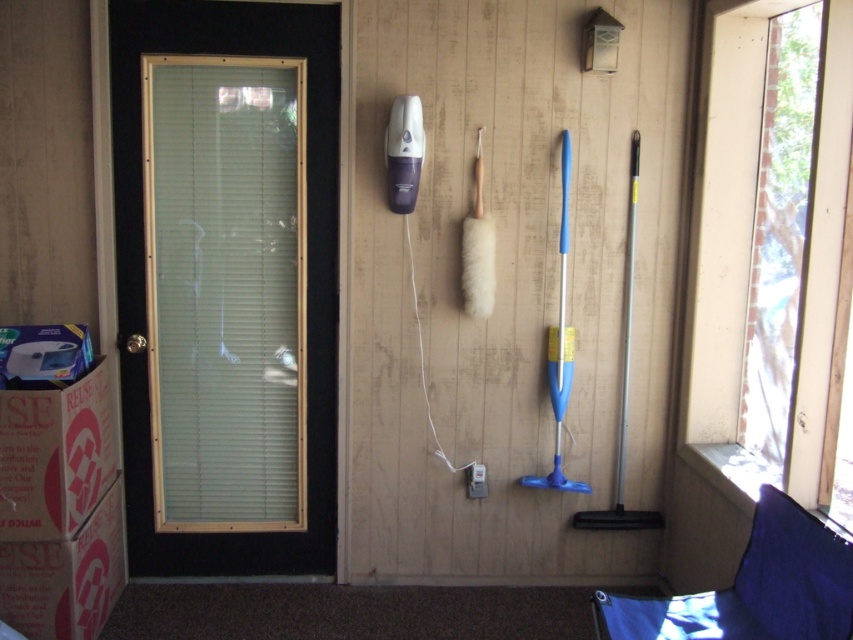
You are organizing the boxes in the room. You need to place the brown cardboard box at lower left and the white cardboard box at lower left on a shelf that can only hold items up to 1.2 meters in height. Given their height difference, which box is more likely to exceed the shelf height limit?

The brown cardboard box at lower left is taller than the white cardboard box at lower left, so it is more likely to exceed the shelf height limit of 1.2 meters.

You are moving boxes into a storage room and need to ensure they fit through the door. Based on the image, can the white cardboard box at lower left pass through the black glass screen door at left without any adjustments?

The black glass screen door at left has a larger size compared to white cardboard box at lower left, so the white cardboard box at lower left can pass through the black glass screen door at left without any adjustments.

You are moving boxes into a storage room and need to know if the white cardboard box at lower left can fit through the black glass screen door at left. Can it pass through based on their sizes?

The black glass screen door at left is wider than the white cardboard box at lower left, so the box can pass through the door.